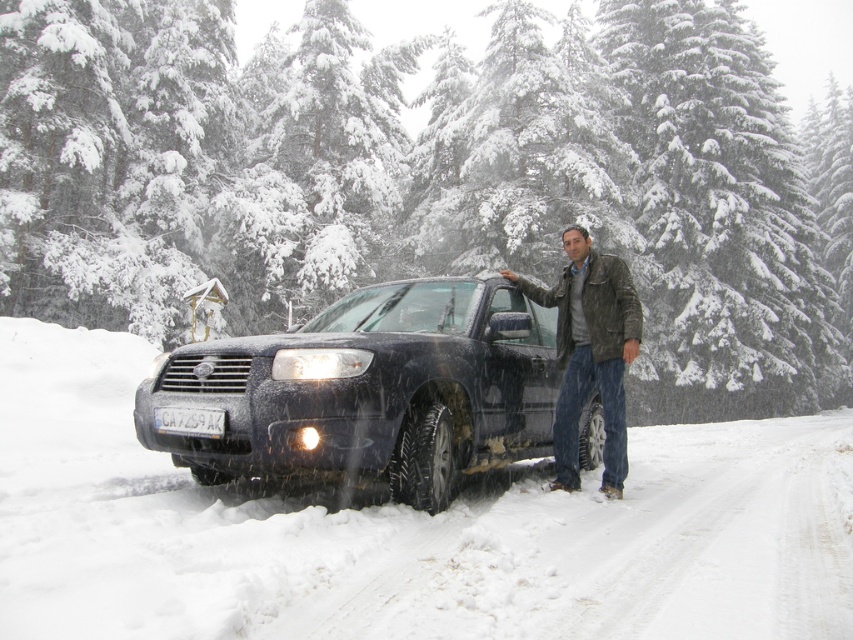
Question: Which point is farther to the camera?

Choices:
 (A) leather jacket at center
 (B) snow-covered evergreen tree at center
 (C) white plastic license plate at center
 (D) white powdery snow at center

Answer: (B)

Question: Is white powdery snow at center above matte black suv at center?

Choices:
 (A) yes
 (B) no

Answer: (B)

Question: Which is nearer to the leather jacket at center?

Choices:
 (A) white powdery snow at center
 (B) snow-covered evergreen tree at center
 (C) white plastic license plate at center
 (D) matte black suv at center

Answer: (D)

Question: Is leather jacket at center positioned in front of white plastic license plate at center?

Choices:
 (A) yes
 (B) no

Answer: (B)

Question: Can you confirm if white powdery snow at center is positioned above matte black suv at center?

Choices:
 (A) no
 (B) yes

Answer: (A)

Question: Which point is closer to the camera?

Choices:
 (A) leather jacket at center
 (B) white powdery snow at center
 (C) snow-covered evergreen tree at center

Answer: (B)